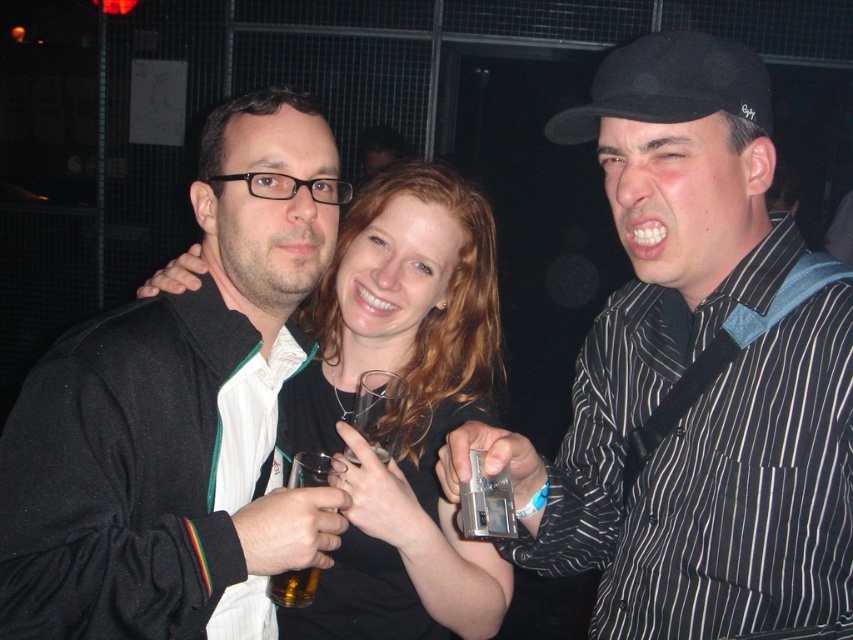
Between black matte jacket at left and translucent glass beer at center, which one appears on the right side from the viewer's perspective?

translucent glass beer at center

Does point (270, 208) lie in front of point (299, 476)?

Yes, it is in front of point (299, 476).

Locate an element on the screen. black matte jacket at left is located at coordinates (177, 412).

The width and height of the screenshot is (853, 640). Identify the location of black matte jacket at left. (177, 412).

Between point (440, 464) and point (349, 477), which one is positioned in front?

Point (440, 464)

Can you confirm if black striped shirt at center is positioned to the left of smooth black dress at center?

Incorrect, black striped shirt at center is not on the left side of smooth black dress at center.

Does point (715, 515) come closer to viewer compared to point (424, 620)?

Yes, point (715, 515) is in front of point (424, 620).

Where is `black striped shirt at center`? The height and width of the screenshot is (640, 853). black striped shirt at center is located at coordinates (692, 376).

Is black matte baseball cap at right below translucent glass beer at center?

Incorrect, black matte baseball cap at right is not positioned below translucent glass beer at center.

Is black matte baseball cap at right positioned at the back of translucent glass beer at center?

No, it is in front of translucent glass beer at center.

Which is behind, point (607, 99) or point (291, 460)?

The point (291, 460) is behind.

Where is `black matte baseball cap at right`? black matte baseball cap at right is located at coordinates (670, 84).